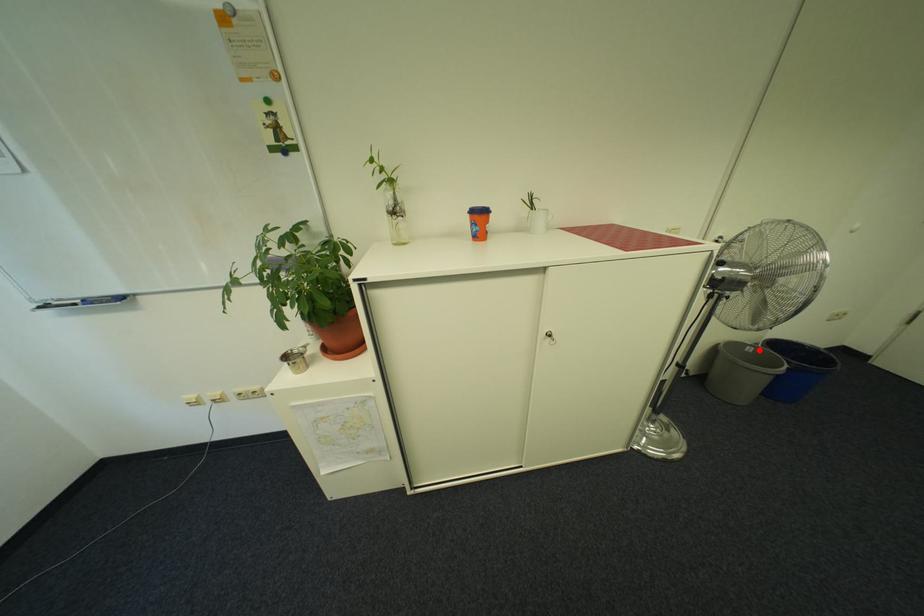
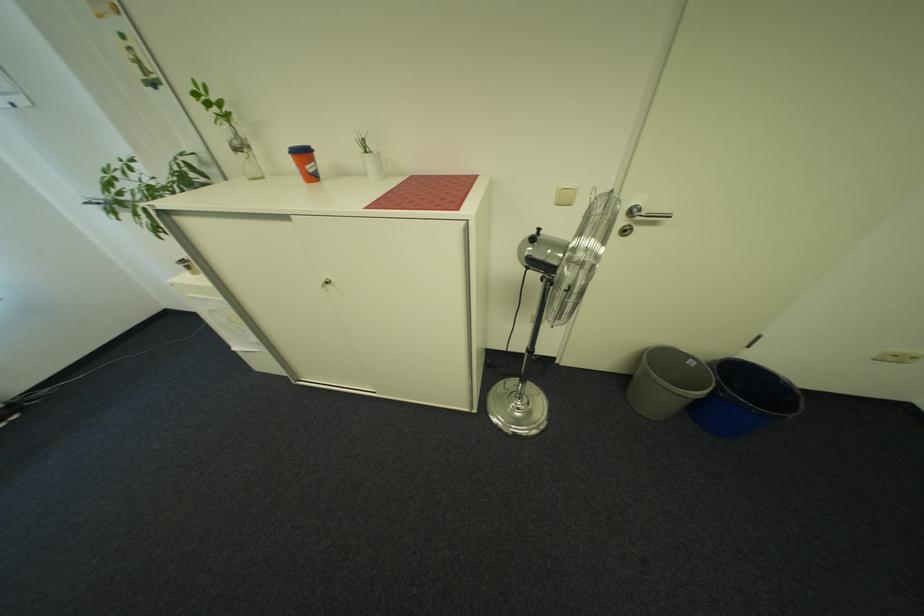
Where in the second image is the point corresponding to the highlighted location from the first image?

(700, 363)